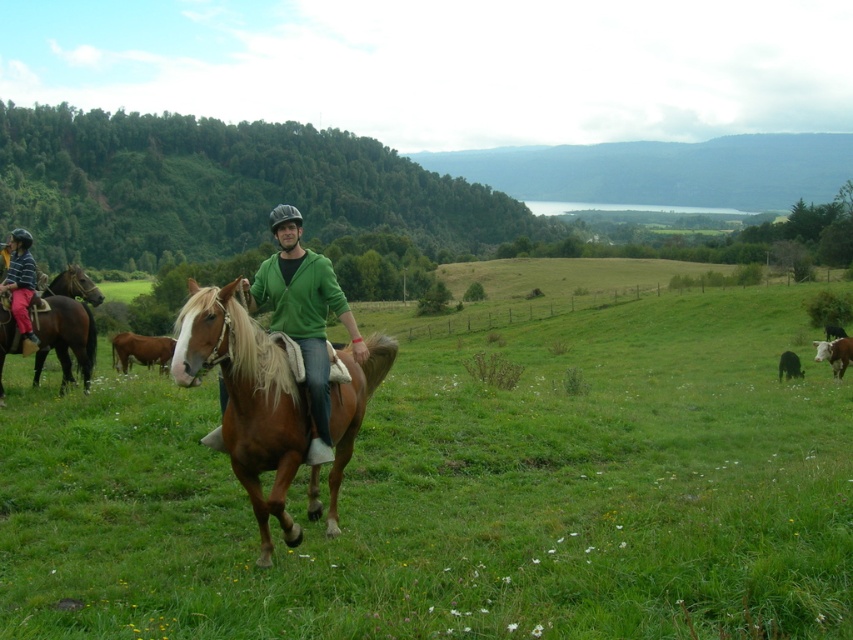
Is green grassy field at center taller than brown glossy horse at lower right?

Correct, green grassy field at center is much taller as brown glossy horse at lower right.

Locate an element on the screen. green grassy field at center is located at coordinates (461, 492).

Where is `green grassy field at center`? Image resolution: width=853 pixels, height=640 pixels. green grassy field at center is located at coordinates (461, 492).

Can you confirm if green grassy field at center is positioned to the left of brown glossy horse at center?

In fact, green grassy field at center is to the right of brown glossy horse at center.

Is green grassy field at center thinner than brown glossy horse at center?

Incorrect, green grassy field at center's width is not less than brown glossy horse at center's.

You are a GUI agent. You are given a task and a screenshot of the screen. Output one action in this format:
    pyautogui.click(x=<x>, y=<y>)
    Task: Click on the green grassy field at center
    The width and height of the screenshot is (853, 640).
    Given the screenshot: What is the action you would take?
    pyautogui.click(x=461, y=492)

You are a GUI agent. You are given a task and a screenshot of the screen. Output one action in this format:
    pyautogui.click(x=<x>, y=<y>)
    Task: Click on the green grassy field at center
    The image size is (853, 640).
    Given the screenshot: What is the action you would take?
    pyautogui.click(x=461, y=492)

Which is in front, point (577, 346) or point (305, 280)?

Positioned in front is point (305, 280).

Does green grassy field at center come in front of green matte jacket at center?

Yes, it is.

Does point (184, 573) come farther from viewer compared to point (323, 307)?

No, it is not.

Image resolution: width=853 pixels, height=640 pixels. I want to click on green grassy field at center, so click(461, 492).